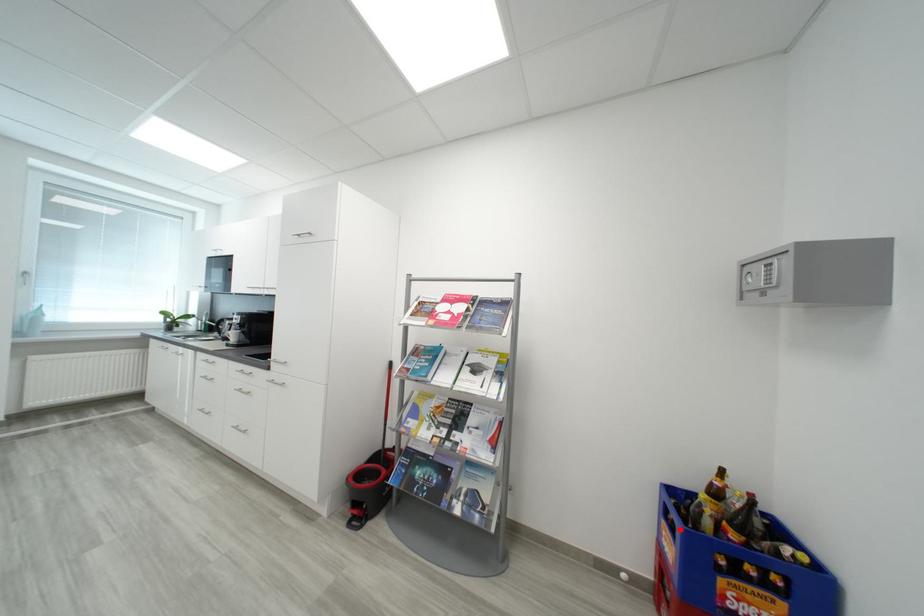
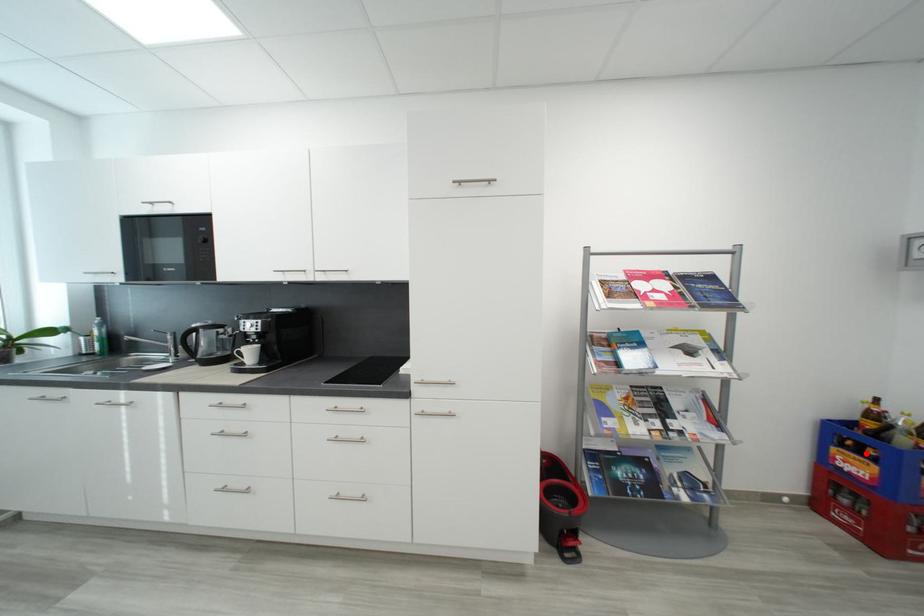
I am providing you with two images of the same scene from different viewpoints. A red point is marked on the first image and another point is marked on the second image. Does the point marked in image1 correspond to the same location as the one in image2?

Yes